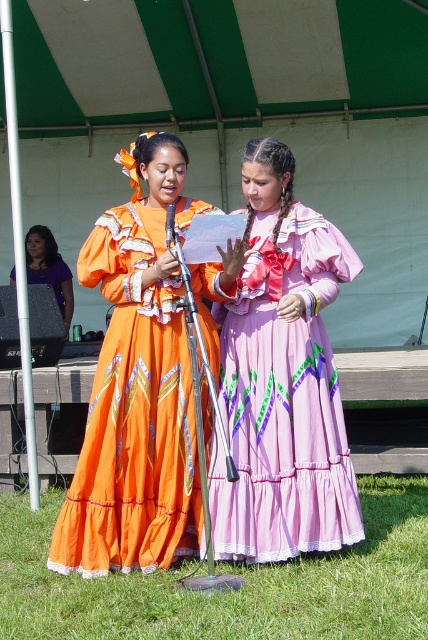
Is matte orange dress at center thinner than green grass at lower center?

Yes, matte orange dress at center is thinner than green grass at lower center.

Is point (145, 221) positioned before point (315, 614)?

No, (145, 221) is behind (315, 614).

This screenshot has width=428, height=640. I want to click on matte orange dress at center, so click(136, 387).

Can you confirm if pink satin dress at center is smaller than green grass at lower center?

Correct, pink satin dress at center occupies less space than green grass at lower center.

From the picture: Is pink satin dress at center in front of green grass at lower center?

That is False.

Between point (269, 365) and point (284, 632), which one is positioned behind?

The point (269, 365) is more distant.

Locate an element on the screen. pink satin dress at center is located at coordinates (282, 380).

Can you confirm if matte orange dress at center is positioned above purple satin laptop at left?

Actually, matte orange dress at center is below purple satin laptop at left.

Is point (70, 502) positioned in front of point (36, 228)?

That is True.

This screenshot has height=640, width=428. Describe the element at coordinates (136, 387) in the screenshot. I see `matte orange dress at center` at that location.

Find the location of a particular element. matte orange dress at center is located at coordinates (136, 387).